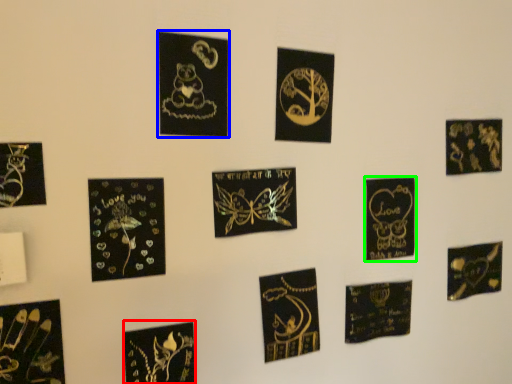
Question: Which object is the closest to the picture frame (highlighted by a red box)? Choose among these: picture frame (highlighted by a blue box) or picture frame (highlighted by a green box).

Choices:
 (A) picture frame
 (B) picture frame

Answer: (A)